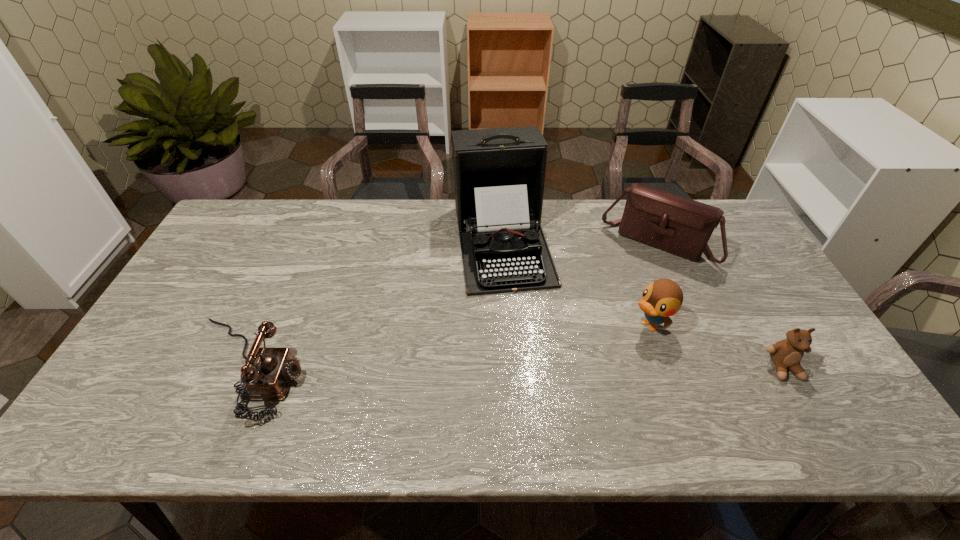
Locate an element on the screen. This screenshot has height=540, width=960. vacant area situated inside the open case of the fourth object from right to left is located at coordinates (519, 325).

The height and width of the screenshot is (540, 960). I want to click on free space located inside the open case of the fourth object from right to left, so click(518, 320).

Locate an element on the screen. The image size is (960, 540). vacant space situated 0.330m inside the open case of the fourth object from right to left is located at coordinates (536, 397).

This screenshot has height=540, width=960. Identify the location of vacant space located on the front-facing side of the duck. (579, 363).

You are a GUI agent. You are given a task and a screenshot of the screen. Output one action in this format:
    pyautogui.click(x=<x>, y=<y>)
    Task: Click on the vacant area situated on the front-facing side of the duck
    This screenshot has width=960, height=540.
    Given the screenshot: What is the action you would take?
    pyautogui.click(x=569, y=369)

You are a GUI agent. You are given a task and a screenshot of the screen. Output one action in this format:
    pyautogui.click(x=<x>, y=<y>)
    Task: Click on the vacant space located 0.130m on the front-facing side of the duck
    This screenshot has width=960, height=540.
    Given the screenshot: What is the action you would take?
    pyautogui.click(x=597, y=353)

I want to click on shoulder bag located in the far edge section of the desktop, so click(672, 223).

Locate an element on the screen. The image size is (960, 540). typewriter situated at the far edge is located at coordinates (499, 174).

Locate an element on the screen. This screenshot has height=540, width=960. telephone located at the near edge is located at coordinates (268, 378).

Where is `teddy bear located at the near edge`? The image size is (960, 540). teddy bear located at the near edge is located at coordinates (786, 354).